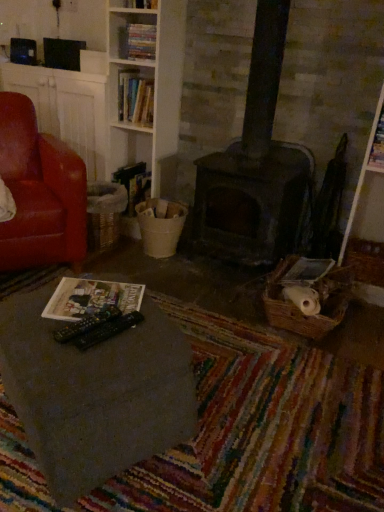
Where is `vacant space to the right of smooth gray table at lower left`? This screenshot has height=512, width=384. vacant space to the right of smooth gray table at lower left is located at coordinates (249, 417).